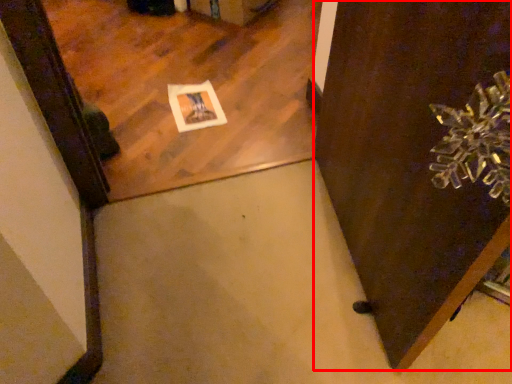
Question: Observing the image, what is the correct spatial positioning of door (annotated by the red box) in reference to mirror?

Choices:
 (A) left
 (B) right

Answer: (B)